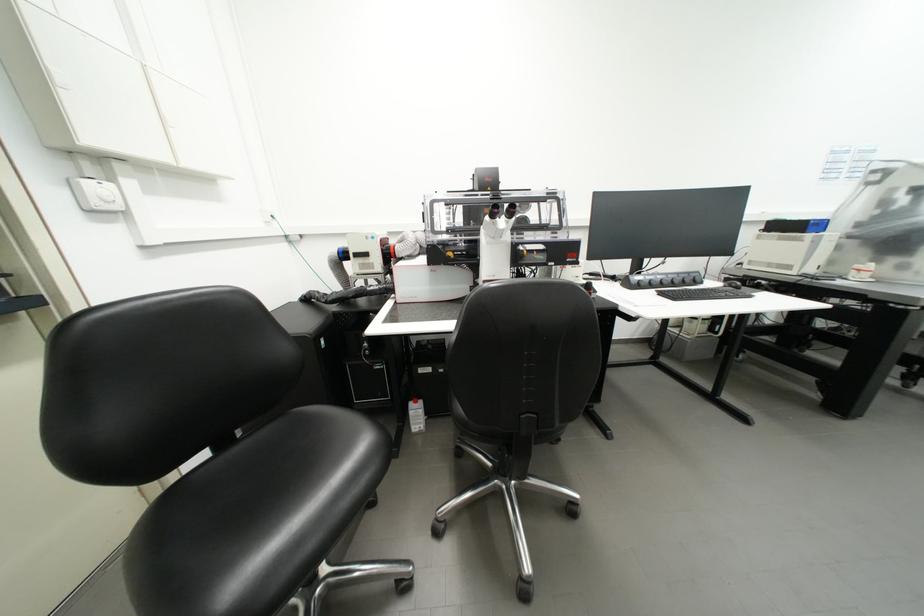
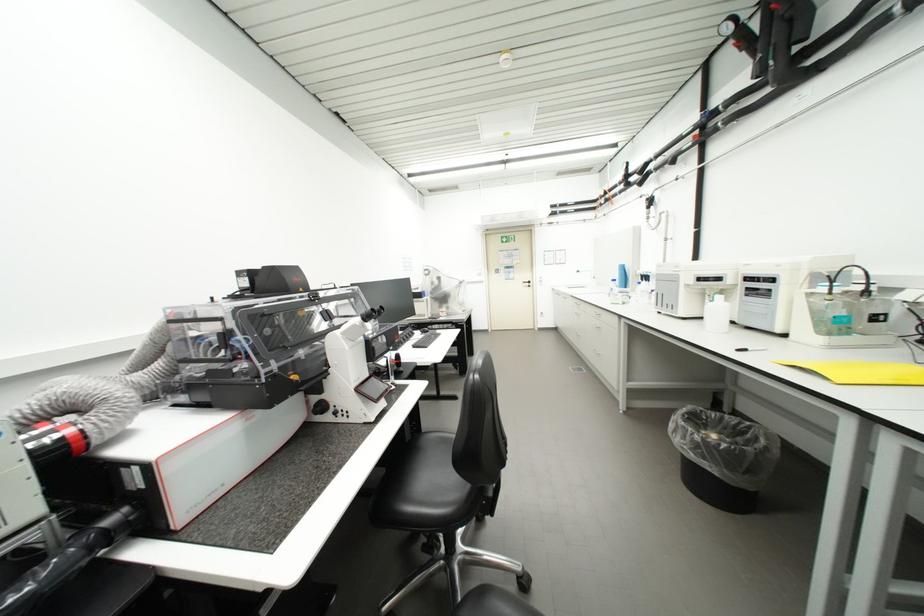
Question: Based on the continuous images, in which direction is the camera rotating? Reply with the corresponding letter.

Choices:
 (A) Left
 (B) Right
 (C) Up
 (D) Down

Answer: (B)